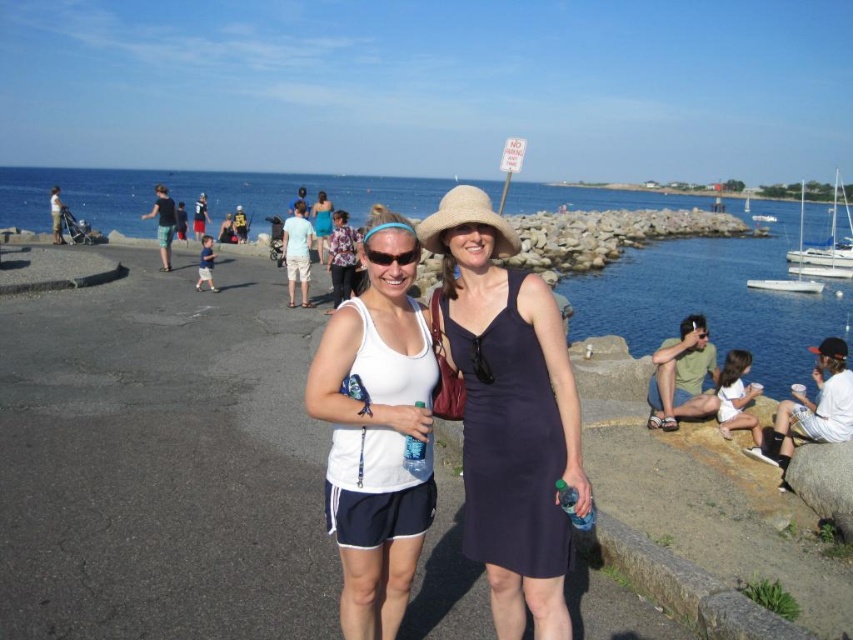
You are standing at the center of the image and want to locate the white sailboat at right. According to the coordinates given, in which direction should you look to find it?

The white sailboat at right is located at coordinates 0.383 on the x axis and 0.970 on the y axis. Since the x value is 0.383, which is less than 0.5, it means the object is positioned to the left side of the image. The y value of 0.970 indicates it is near the top of the image. Therefore, you should look to the upper left direction to locate the white sailboat at right.

You are taking a photo of the two women at the seaside promenade. The white matte tank top at center and the black plastic sunglasses at center are both in the frame. Which object will appear bigger in your photo?

The white matte tank top at center is larger in size than the black plastic sunglasses at center, so it will appear bigger in the photo.

You are planning to dock a boat that is 10 meters wide. Looking at the image, which of the two boats, the white sailboat at right or the white glossy sailboat at right, would you choose to ensure your boat can fit alongside it without overlapping?

The white sailboat at right might be wider than white glossy sailboat at right, so choosing the white sailboat at right would provide more space for your 10 meter wide boat to dock alongside without overlapping.